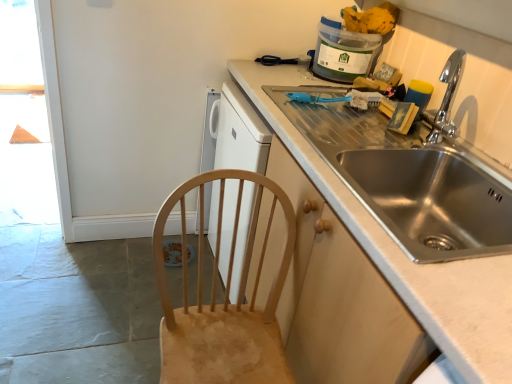
In order to click on free point above translucent plastic container at upper right (from a real-world perspective) in this screenshot , I will do tap(345, 23).